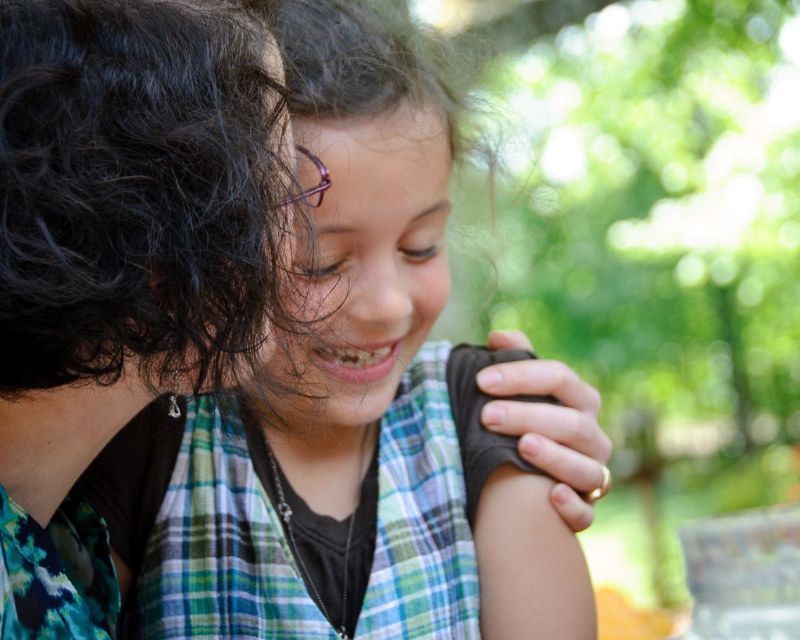
What do you see at coordinates (121, 259) in the screenshot?
I see `black fabric at upper left` at bounding box center [121, 259].

Which of these two, black fabric at upper left or matte green plaid shirt at center, stands taller?

black fabric at upper left is taller.

Is point (2, 460) in front of point (370, 356)?

That is True.

At what (x,y) coordinates should I click in order to perform the action: click on black fabric at upper left. Please return your answer as a coordinate pair (x, y). This screenshot has width=800, height=640. Looking at the image, I should click on (121, 259).

Locate an element on the screen. This screenshot has width=800, height=640. green plaid shirt at center is located at coordinates (354, 404).

Which is below, green plaid shirt at center or matte green plaid shirt at center?

green plaid shirt at center is below.

Is point (314, 8) farther from viewer compared to point (366, 196)?

Yes, it is.

The height and width of the screenshot is (640, 800). Find the location of `green plaid shirt at center`. green plaid shirt at center is located at coordinates (354, 404).

Between green plaid shirt at center and black fabric at upper left, which one has less height?

black fabric at upper left is shorter.

Does green plaid shirt at center have a smaller size compared to black fabric at upper left?

Actually, green plaid shirt at center might be larger than black fabric at upper left.

The height and width of the screenshot is (640, 800). What do you see at coordinates (354, 404) in the screenshot? I see `green plaid shirt at center` at bounding box center [354, 404].

Locate an element on the screen. The width and height of the screenshot is (800, 640). green plaid shirt at center is located at coordinates (354, 404).